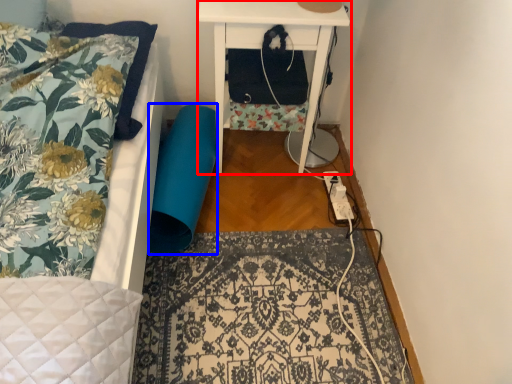
Question: Among these objects, which one is nearest to the camera, nightstand (highlighted by a red box) or swivel chair (highlighted by a blue box)?

Choices:
 (A) nightstand
 (B) swivel chair

Answer: (A)